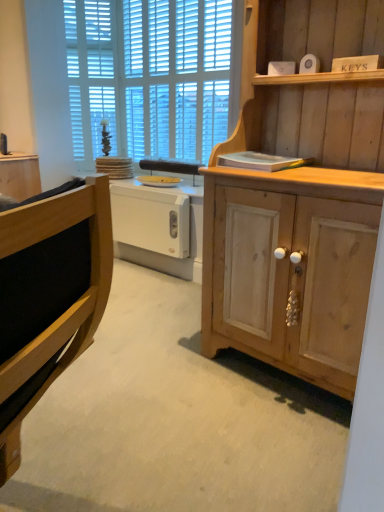
What do you see at coordinates (151, 220) in the screenshot?
I see `white plastic drawer at center` at bounding box center [151, 220].

What is the approximate width of white wooden blinds at upper center?

It is 2.65 inches.

What is the approximate height of white plastic radiator at center?

It is 1.53 inches.

You are a GUI agent. You are given a task and a screenshot of the screen. Output one action in this format:
    pyautogui.click(x=<x>, y=<y>)
    Task: Click on the white plastic drawer at center
    
    Given the screenshot: What is the action you would take?
    pyautogui.click(x=151, y=220)

Is white wooden blinds at upper center aimed at wooden cabinet at left, which appears as the 2th cabinetry when viewed from the right?

Yes, white wooden blinds at upper center is facing wooden cabinet at left, which appears as the 2th cabinetry when viewed from the right.

In the scene shown: Is white wooden blinds at upper center far away from wooden cabinet at left, which appears as the 2th cabinetry when viewed from the right?

Absolutely, white wooden blinds at upper center is distant from wooden cabinet at left, which appears as the 2th cabinetry when viewed from the right.

Which object is closer to the camera, white wooden blinds at upper center or wooden cabinet at left, which appears as the 2th cabinetry when viewed from the right?

white wooden blinds at upper center is closer to the camera.

Identify the location of cabinetry lying above the white plastic radiator at center (from the image's perspective). (20, 175).

Based on the photo, would you consider white plastic radiator at center to be distant from wooden cabinet at left, arranged as the 1th cabinetry when viewed from the back?

No.

Consider the image. From a real-world perspective, who is located lower, white plastic radiator at center or wooden cabinet at left, which is the second cabinetry from front to back?

wooden cabinet at left, which is the second cabinetry from front to back, is physically lower.

Does white plastic radiator at center come in front of wooden cabinet at left, arranged as the 1th cabinetry when viewed from the back?

Yes, white plastic radiator at center is in front of wooden cabinet at left, arranged as the 1th cabinetry when viewed from the back.

Find the location of a particular element. This screenshot has width=384, height=512. window that appears above the white plastic radiator at center (from a real-world perspective) is located at coordinates (150, 76).

Can you confirm if white wooden blinds at upper center is bigger than white plastic radiator at center?

Indeed, white wooden blinds at upper center has a larger size compared to white plastic radiator at center.

From a real-world perspective, is white wooden blinds at upper center positioned above or below white plastic radiator at center?

From a real-world perspective, white wooden blinds at upper center is physically above white plastic radiator at center.

From the image's perspective, is white wooden blinds at upper center above white plastic radiator at center?

Correct, white wooden blinds at upper center appears higher than white plastic radiator at center in the image.

Consider the image. Is white plastic drawer at center beside white wooden blinds at upper center?

white plastic drawer at center is not next to white wooden blinds at upper center, and they're not touching.

Considering the relative sizes of white plastic drawer at center and white wooden blinds at upper center in the image provided, is white plastic drawer at center smaller than white wooden blinds at upper center?

Correct, white plastic drawer at center occupies less space than white wooden blinds at upper center.

Is white plastic drawer at center not within white wooden blinds at upper center?

Yes, white plastic drawer at center is located beyond the bounds of white wooden blinds at upper center.

Does white plastic drawer at center lie in front of white wooden blinds at upper center?

Yes, white plastic drawer at center is closer to the viewer.

From a real-world perspective, relative to wooden cabinet at left, which appears as the 2th cabinetry when viewed from the right, is white plastic drawer at center vertically above or below?

white plastic drawer at center is below wooden cabinet at left, which appears as the 2th cabinetry when viewed from the right.

Between point (177, 224) and point (18, 154), which one is positioned in front?

The point (177, 224) is closer.

Consider the image. Considering the relative sizes of white plastic drawer at center and wooden cabinet at left, which ranks as the first cabinetry in left-to-right order, in the image provided, is white plastic drawer at center bigger than wooden cabinet at left, which ranks as the first cabinetry in left-to-right order,?

No, white plastic drawer at center is not bigger than wooden cabinet at left, which ranks as the first cabinetry in left-to-right order.

Which of these two, white plastic drawer at center or wooden cabinet at left, arranged as the 1th cabinetry when viewed from the back, is thinner?

With smaller width is white plastic drawer at center.

From the picture: Is natural wood cabinet at right, the 2th cabinetry from the back, facing towards white plastic radiator at center?

No, natural wood cabinet at right, the 2th cabinetry from the back, is not aimed at white plastic radiator at center.

Does point (269, 194) come in front of point (155, 182)?

Yes, it is in front of point (155, 182).

Can you confirm if natural wood cabinet at right, the 2th cabinetry from the back, is thinner than white plastic radiator at center?

No, natural wood cabinet at right, the 2th cabinetry from the back, is not thinner than white plastic radiator at center.

Considering the relative sizes of natural wood cabinet at right, the 2th cabinetry from the back, and white plastic radiator at center in the image provided, is natural wood cabinet at right, the 2th cabinetry from the back, smaller than white plastic radiator at center?

No, natural wood cabinet at right, the 2th cabinetry from the back, is not smaller than white plastic radiator at center.

From a real-world perspective, is wooden cabinet at left, which appears as the 2th cabinetry when viewed from the right, below natural wood cabinet at right, the first cabinetry when ordered from right to left?

Yes, from a real-world perspective, wooden cabinet at left, which appears as the 2th cabinetry when viewed from the right, is below natural wood cabinet at right, the first cabinetry when ordered from right to left.

Consider the image. Which object is closer to the camera, wooden cabinet at left, which ranks as the first cabinetry in left-to-right order, or natural wood cabinet at right, the 2th cabinetry from the back?

natural wood cabinet at right, the 2th cabinetry from the back, is in front.

At what (x,y) coordinates should I click in order to perform the action: click on cabinetry on the left side of white wooden blinds at upper center. Please return your answer as a coordinate pair (x, y). The height and width of the screenshot is (512, 384). Looking at the image, I should click on (20, 175).

Image resolution: width=384 pixels, height=512 pixels. What are the coordinates of `appliance above the wooden cabinet at left, arranged as the 1th cabinetry when viewed from the back (from a real-world perspective)` in the screenshot? It's located at (159, 181).

When comparing their distances from white plastic drawer at center, does wooden cabinet at left, which ranks as the first cabinetry in left-to-right order, or white wooden blinds at upper center seem closer?

Based on the image, wooden cabinet at left, which ranks as the first cabinetry in left-to-right order, appears to be nearer to white plastic drawer at center.

Looking at this image, when comparing their distances from white plastic radiator at center, does wooden cabinet at left, which is the second cabinetry from front to back, or natural wood cabinet at right, the 2th cabinetry from the back, seem closer?

wooden cabinet at left, which is the second cabinetry from front to back, lies closer to white plastic radiator at center than the other object.

From the picture: Which object lies further to the anchor point natural wood cabinet at right, the 1th cabinetry when ordered from front to back, white wooden blinds at upper center or wooden cabinet at left, which ranks as the first cabinetry in left-to-right order?

wooden cabinet at left, which ranks as the first cabinetry in left-to-right order, lies further to natural wood cabinet at right, the 1th cabinetry when ordered from front to back, than the other object.

Estimate the real-world distances between objects in this image. Which object is closer to white plastic radiator at center, natural wood cabinet at right, the first cabinetry when ordered from right to left, or wooden cabinet at left, which ranks as the first cabinetry in left-to-right order?

Based on the image, wooden cabinet at left, which ranks as the first cabinetry in left-to-right order, appears to be nearer to white plastic radiator at center.

Looking at this image, looking at the image, which one is located closer to natural wood cabinet at right, the 1th cabinetry when ordered from front to back, white plastic drawer at center or white plastic radiator at center?

white plastic drawer at center is closer to natural wood cabinet at right, the 1th cabinetry when ordered from front to back.

Considering their positions, is wooden cabinet at left, which appears as the 2th cabinetry when viewed from the right, positioned closer to white plastic drawer at center than white plastic radiator at center?

The object closer to white plastic drawer at center is white plastic radiator at center.

Based on their spatial positions, is white plastic radiator at center or wooden cabinet at left, which ranks as the first cabinetry in left-to-right order, further from white wooden blinds at upper center?

Based on the image, wooden cabinet at left, which ranks as the first cabinetry in left-to-right order, appears to be further to white wooden blinds at upper center.

Based on their spatial positions, is white plastic drawer at center or white wooden blinds at upper center closer to wooden cabinet at left, which appears as the 2th cabinetry when viewed from the right?

white plastic drawer at center is positioned closer to the anchor wooden cabinet at left, which appears as the 2th cabinetry when viewed from the right.

Find the location of a particular element. The height and width of the screenshot is (512, 384). appliance between natural wood cabinet at right, which is counted as the second cabinetry, starting from the left, and wooden cabinet at left, which appears as the 2th cabinetry when viewed from the right, along the z-axis is located at coordinates (159, 181).

Identify the location of drawer between wooden cabinet at left, which appears as the 2th cabinetry when viewed from the right, and white plastic radiator at center, in the horizontal direction. This screenshot has width=384, height=512. pos(151,220).

The image size is (384, 512). In order to click on appliance between white wooden blinds at upper center and white plastic drawer at center in the vertical direction in this screenshot , I will do `click(159, 181)`.

Locate an element on the screen. This screenshot has width=384, height=512. window positioned between natural wood cabinet at right, the first cabinetry when ordered from right to left, and wooden cabinet at left, which ranks as the first cabinetry in left-to-right order, from near to far is located at coordinates (150, 76).